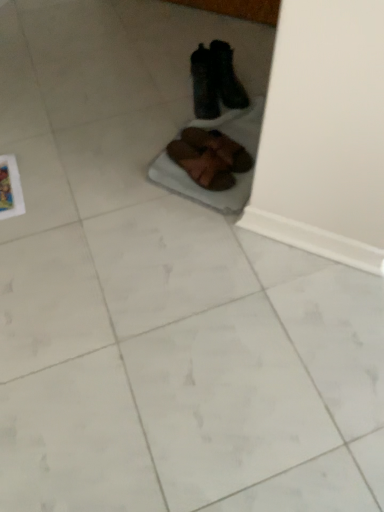
Where is `vacant space in front of brown suede shoes at center, placed as the 4th footwear when sorted from top to bottom`? Image resolution: width=384 pixels, height=512 pixels. vacant space in front of brown suede shoes at center, placed as the 4th footwear when sorted from top to bottom is located at coordinates (203, 194).